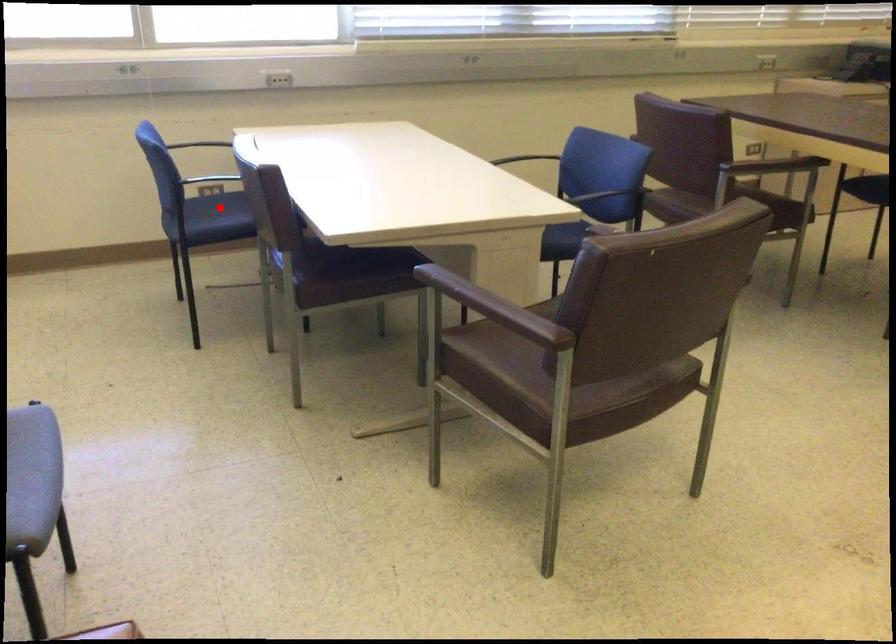
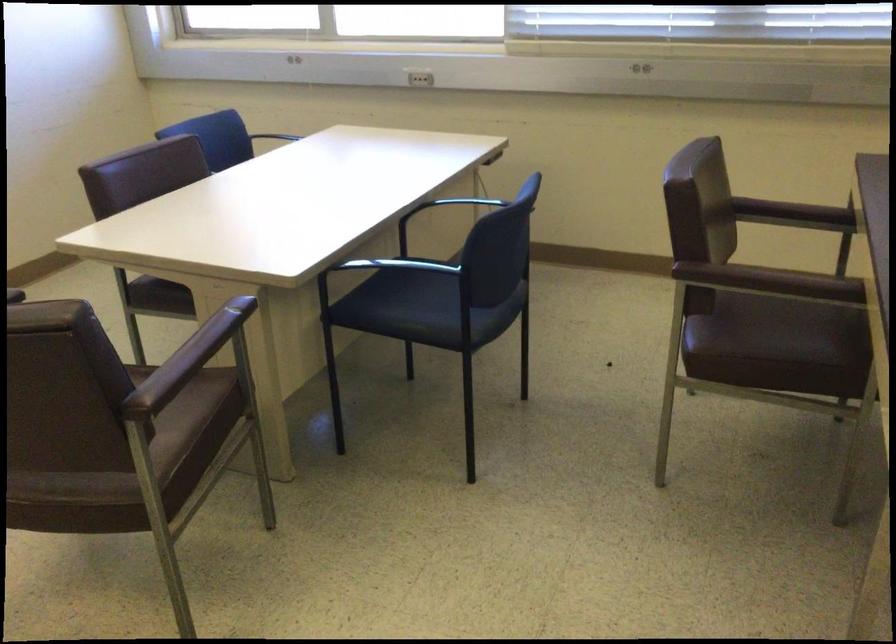
Question: I am providing you with two images of the same scene from different viewpoints. A red point is marked on the first image. At the location where the point appears in image 1, is it still visible in image 2?

Choices:
 (A) Yes
 (B) No

Answer: (B)